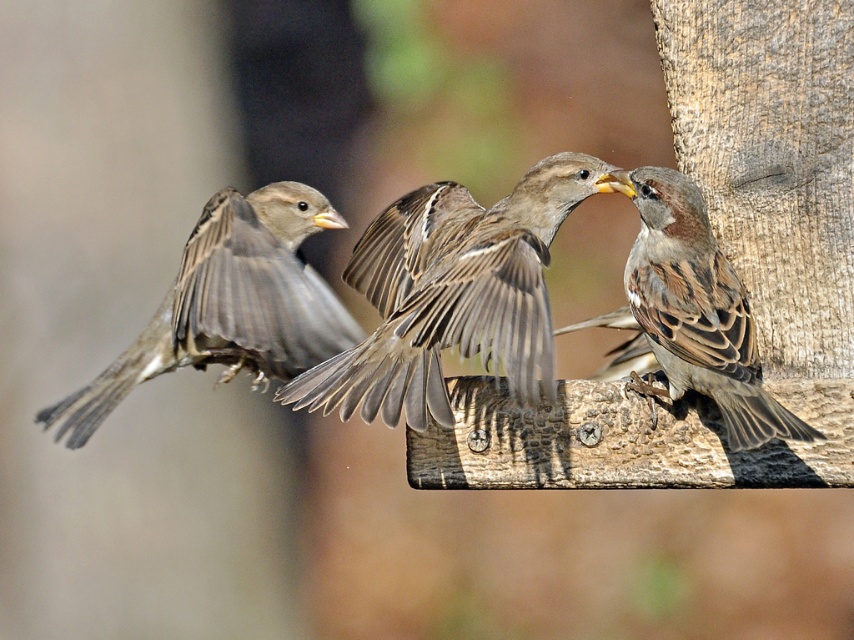
Question: Observing the image, what is the correct spatial positioning of brown speckled feathers at center in reference to brown feathered sparrow at right?

Choices:
 (A) right
 (B) left

Answer: (B)

Question: Which object is closer to the camera taking this photo?

Choices:
 (A) brown feathered sparrow at right
 (B) brown feathered sparrow at left
 (C) brown speckled feathers at center

Answer: (C)

Question: Based on their relative distances, which object is nearer to the brown speckled feathers at center?

Choices:
 (A) brown feathered sparrow at left
 (B) brown feathered sparrow at right

Answer: (A)

Question: Does brown feathered sparrow at left have a lesser width compared to brown feathered sparrow at right?

Choices:
 (A) no
 (B) yes

Answer: (A)

Question: Can you confirm if brown speckled feathers at center is positioned to the right of brown feathered sparrow at left?

Choices:
 (A) no
 (B) yes

Answer: (B)

Question: Estimate the real-world distances between objects in this image. Which object is closer to the brown feathered sparrow at right?

Choices:
 (A) brown feathered sparrow at left
 (B) brown speckled feathers at center

Answer: (B)